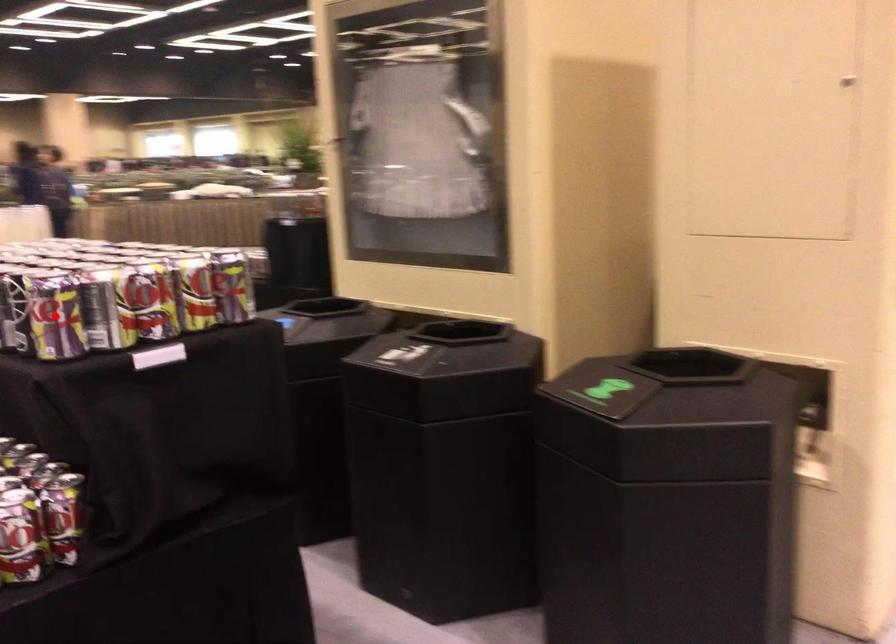
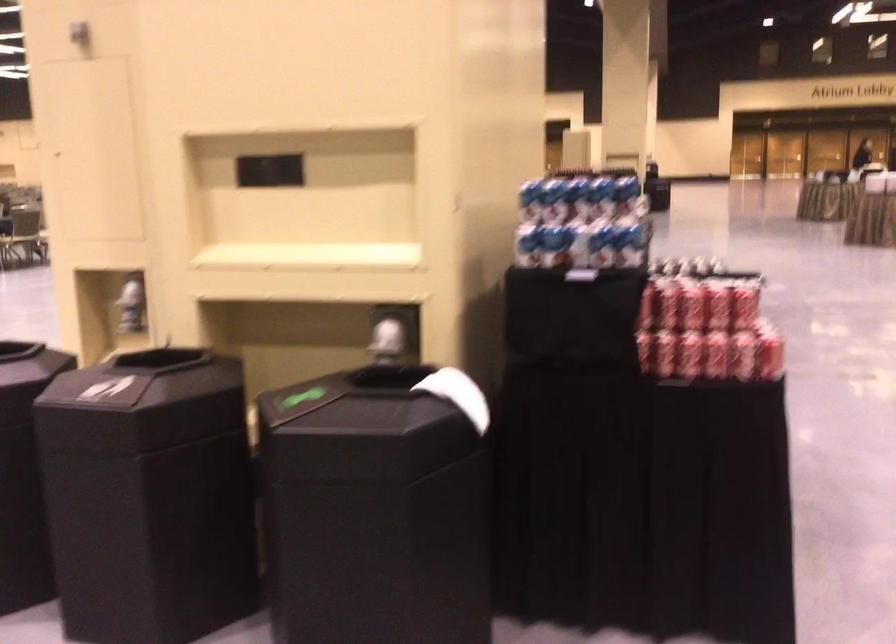
Question: I am providing you with two images of the same scene from different viewpoints. A red point is marked on the first image. Is the red point's position out of view in image 2?

Choices:
 (A) Yes
 (B) No

Answer: (A)